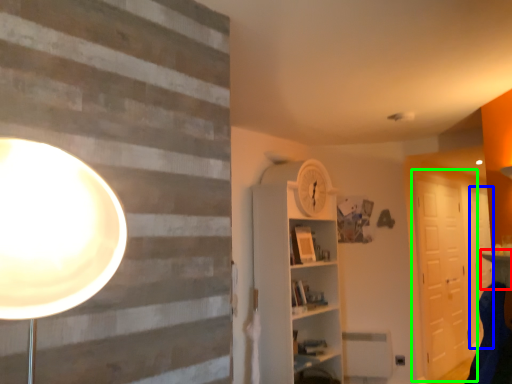
Question: Based on their relative distances, which object is nearer to table (highlighted by a red box)? Choose from door (highlighted by a blue box) and barn door (highlighted by a green box).

Choices:
 (A) door
 (B) barn door

Answer: (B)